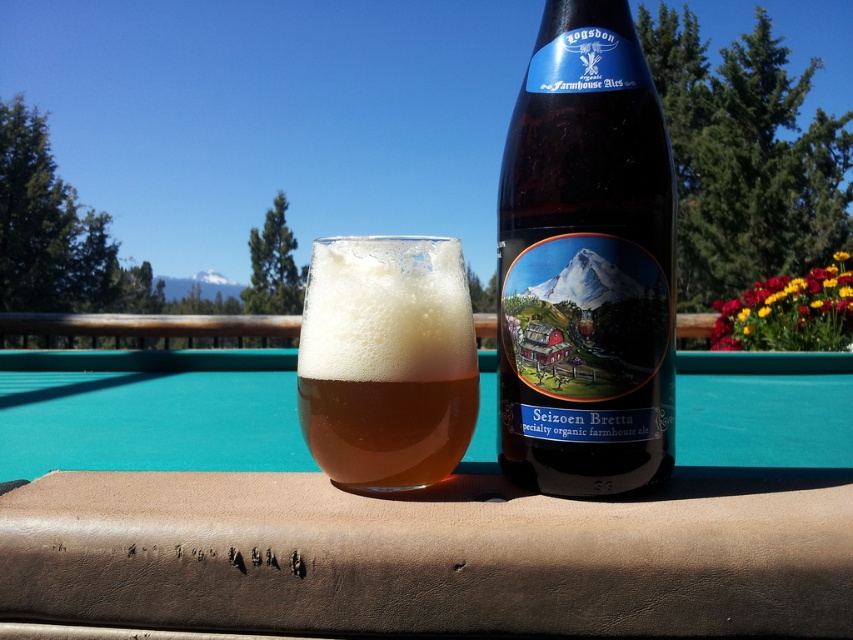
You are a bartender setting up a new drink station. You have a brown leather table at center and an amber glass beer at center. Which object is taller?

The brown leather table at center is taller than the amber glass beer at center.

You are setting up a small bar area and have a brown glass bottle at center and a brown leather table at center. Which object would require more space on the table to place it properly?

The brown leather table at center is bigger than the brown glass bottle at center, so it would require more space on the table to place it properly.

You are a bartender setting up a new drink station. You have a brown leather table at center and an amber glass beer at center. Where should you place a new tray so it doesn t block the beer? Use the spatial relationship between the objects to decide.

The brown leather table at center is on the left side of the amber glass beer at center. To avoid blocking the beer, place the tray to the right of the amber glass beer at center, away from the table.